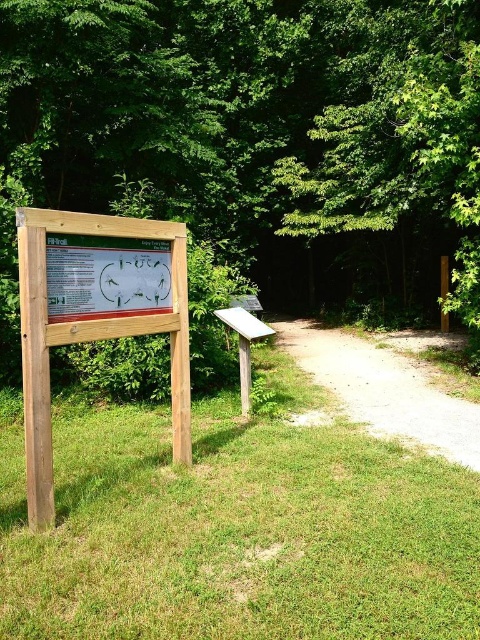
Question: Which point appears closest to the camera in this image?

Choices:
 (A) (136, 472)
 (B) (40, 145)
 (C) (83, 240)
 (D) (61, 225)

Answer: (D)

Question: Which of the following is the farthest from the observer?

Choices:
 (A) wooden sign at center
 (B) dirt path at center

Answer: (B)

Question: Estimate the real-world distances between objects in this image. Which object is farther from the green wood sign at center?

Choices:
 (A) green grass at lower left
 (B) wooden sign at center

Answer: (A)

Question: Is green leafy tree at upper center further to the viewer compared to green grass at lower left?

Choices:
 (A) no
 (B) yes

Answer: (B)

Question: Can you confirm if wooden sign at center is smaller than dirt path at center?

Choices:
 (A) yes
 (B) no

Answer: (A)

Question: Can you confirm if wooden sign at center is positioned to the left of dirt path at center?

Choices:
 (A) no
 (B) yes

Answer: (B)